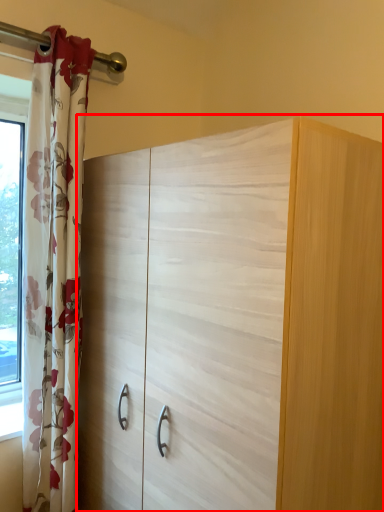
Question: From the image, what is the correct spatial relationship of cupboard (annotated by the red box) in relation to curtain?

Choices:
 (A) right
 (B) left

Answer: (A)